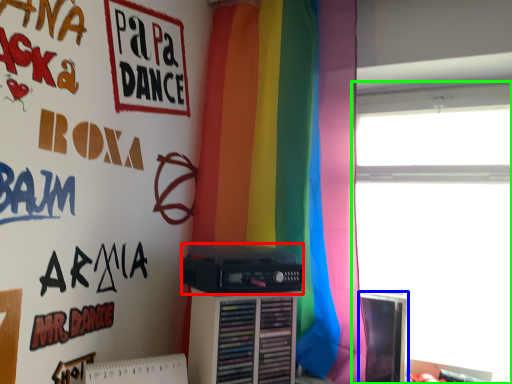
Question: Based on their relative distances, which object is nearer to cassette (highlighted by a red box)? Choose from computer monitor (highlighted by a blue box) and window (highlighted by a green box).

Choices:
 (A) computer monitor
 (B) window

Answer: (A)